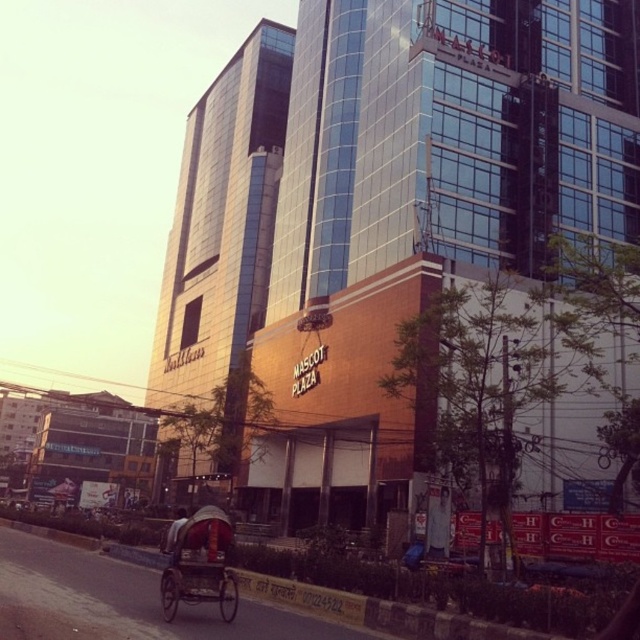
You are a city planner assessing the space between the glassy metallic building at center and the wooden rickshaw at lower left. If you need to place a new bench that is 2 meters wide, would there be enough space between them?

The glassy metallic building at center might be wider than wooden rickshaw at lower left, but without exact measurements of the distance between them, it is uncertain if the 2 meter bench would fit. Further measurements are needed.

You are a photographer wanting to capture both the glassy metallic building at center and the wooden rickshaw at lower left in the same frame. Based on their sizes in the image, which object would appear larger in your photo?

The glassy metallic building at center appears larger in the photo because it is taller than the wooden rickshaw at lower left.